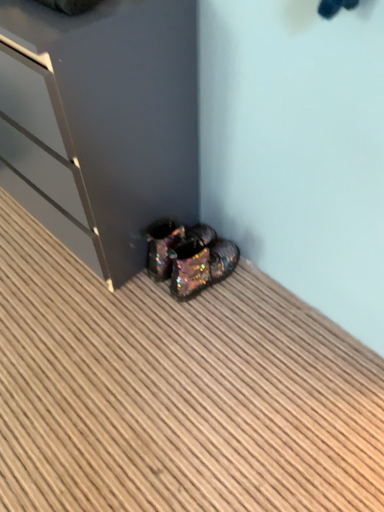
Question: Considering the relative sizes of glossy dark gray dresser at lower left and iridescent glittery shoes at lower center in the image provided, is glossy dark gray dresser at lower left thinner than iridescent glittery shoes at lower center?

Choices:
 (A) no
 (B) yes

Answer: (A)

Question: From the image's perspective, is glossy dark gray dresser at lower left on top of iridescent glittery shoes at lower center?

Choices:
 (A) no
 (B) yes

Answer: (B)

Question: Is glossy dark gray dresser at lower left to the right of iridescent glittery shoes at lower center from the viewer's perspective?

Choices:
 (A) no
 (B) yes

Answer: (A)

Question: Can you confirm if glossy dark gray dresser at lower left is taller than iridescent glittery shoes at lower center?

Choices:
 (A) yes
 (B) no

Answer: (A)

Question: Is iridescent glittery shoes at lower center completely or partially inside glossy dark gray dresser at lower left?

Choices:
 (A) no
 (B) yes

Answer: (A)

Question: Are glossy dark gray dresser at lower left and iridescent glittery shoes at lower center making contact?

Choices:
 (A) yes
 (B) no

Answer: (B)

Question: Considering the relative positions of iridescent glittery shoes at lower center and iridescent metallic shoes at lower center in the image provided, is iridescent glittery shoes at lower center to the right of iridescent metallic shoes at lower center from the viewer's perspective?

Choices:
 (A) yes
 (B) no

Answer: (A)

Question: Is iridescent glittery shoes at lower center oriented away from iridescent metallic shoes at lower center?

Choices:
 (A) no
 (B) yes

Answer: (A)

Question: Does iridescent glittery shoes at lower center touch iridescent metallic shoes at lower center?

Choices:
 (A) yes
 (B) no

Answer: (B)

Question: From a real-world perspective, is iridescent glittery shoes at lower center on iridescent metallic shoes at lower center?

Choices:
 (A) no
 (B) yes

Answer: (B)

Question: From the image's perspective, is iridescent glittery shoes at lower center on iridescent metallic shoes at lower center?

Choices:
 (A) no
 (B) yes

Answer: (B)

Question: Would you say iridescent glittery shoes at lower center is outside iridescent metallic shoes at lower center?

Choices:
 (A) no
 (B) yes

Answer: (B)

Question: Can you confirm if iridescent glittery shoes at lower center is positioned to the right of glossy dark gray dresser at lower left?

Choices:
 (A) yes
 (B) no

Answer: (A)